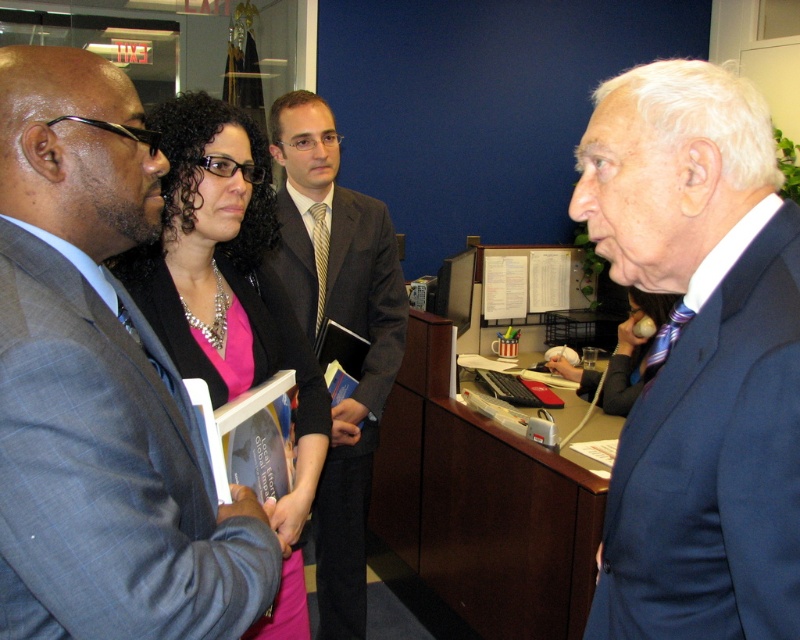
Consider the image. Between matte gray suit at center and pink satin blouse at center, which one has more height?

With more height is pink satin blouse at center.

Between point (48, 432) and point (293, 604), which one is positioned behind?

The point (293, 604) is behind.

Locate an element on the screen. The height and width of the screenshot is (640, 800). matte gray suit at center is located at coordinates (98, 387).

Between pink satin blouse at center and dark gray suit at center, which one appears on the right side from the viewer's perspective?

dark gray suit at center

Consider the image. How far apart are pink satin blouse at center and dark gray suit at center?

pink satin blouse at center is 22.09 inches from dark gray suit at center.

Who is more distant from viewer, (218, 124) or (308, 109)?

The point (308, 109) is more distant.

Locate an element on the screen. Image resolution: width=800 pixels, height=640 pixels. pink satin blouse at center is located at coordinates (230, 301).

From the picture: Does blue suit at right have a greater height compared to pink satin blouse at center?

In fact, blue suit at right may be shorter than pink satin blouse at center.

Is the position of blue suit at right more distant than that of pink satin blouse at center?

No, blue suit at right is in front of pink satin blouse at center.

Locate an element on the screen. Image resolution: width=800 pixels, height=640 pixels. blue suit at right is located at coordinates (700, 356).